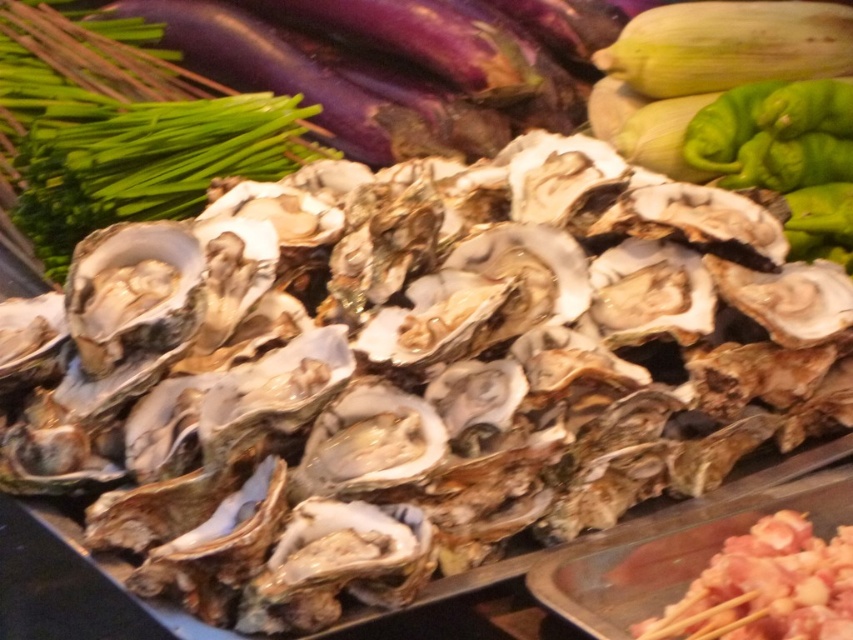
Which of these two, green leafy at upper left or pink raw meat at bottom right, stands shorter?

With less height is pink raw meat at bottom right.

What do you see at coordinates (122, 129) in the screenshot? I see `green leafy at upper left` at bounding box center [122, 129].

What do you see at coordinates (122, 129) in the screenshot? I see `green leafy at upper left` at bounding box center [122, 129].

The image size is (853, 640). What are the coordinates of `green leafy at upper left` in the screenshot? It's located at (122, 129).